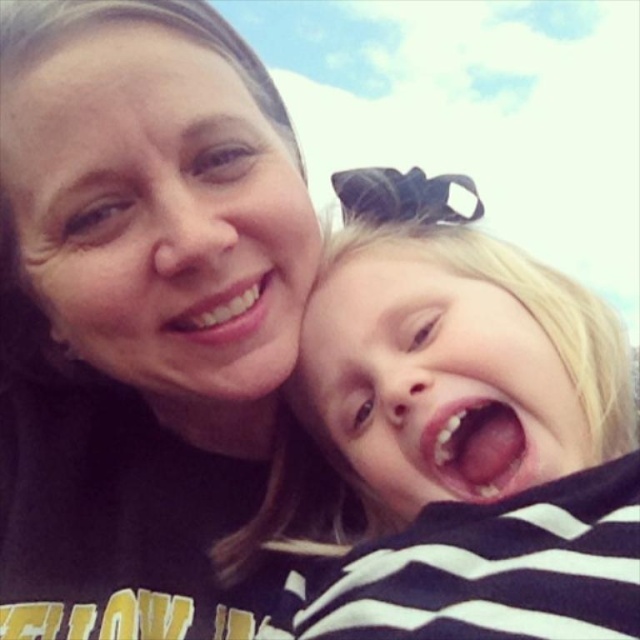
Question: Is matte black shirt at center closer to the viewer compared to striped fabric shirt at right?

Choices:
 (A) no
 (B) yes

Answer: (A)

Question: From the image, what is the correct spatial relationship of matte black shirt at center in relation to striped fabric shirt at right?

Choices:
 (A) above
 (B) below

Answer: (A)

Question: Which point is closer to the camera?

Choices:
 (A) striped fabric shirt at right
 (B) matte black shirt at center

Answer: (A)

Question: Which point appears farthest from the camera in this image?

Choices:
 (A) (360, 426)
 (B) (224, 115)

Answer: (A)

Question: Is matte black shirt at center to the left of striped fabric shirt at right from the viewer's perspective?

Choices:
 (A) no
 (B) yes

Answer: (B)